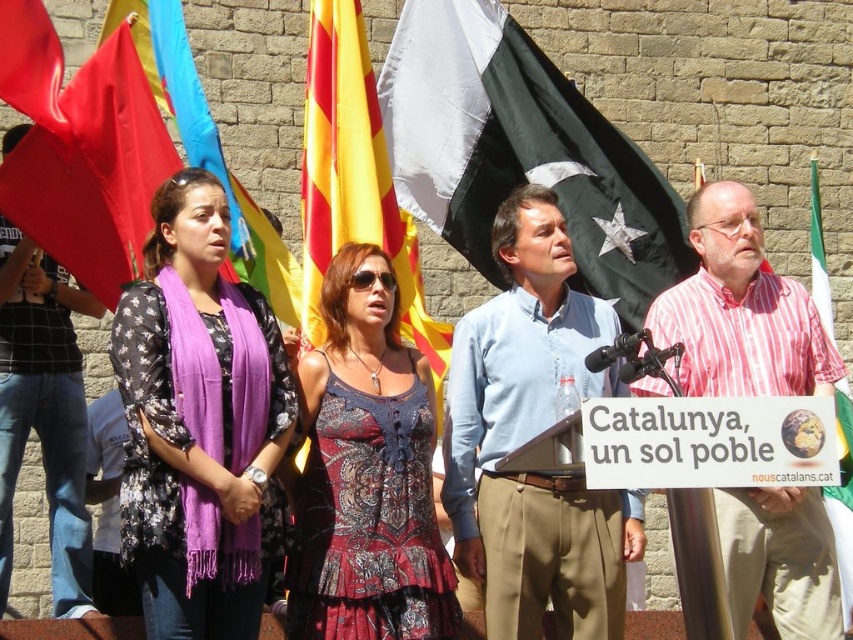
From the picture: Between light blue shirt at center and white paper sign at center, which one is positioned lower?

white paper sign at center

Which of these two, light blue shirt at center or white paper sign at center, stands taller?

Standing taller between the two is light blue shirt at center.

Locate an element on the screen. The image size is (853, 640). light blue shirt at center is located at coordinates (532, 436).

Does shiny red flag at upper left appear over red fabric flag at upper left?

Incorrect, shiny red flag at upper left is not positioned above red fabric flag at upper left.

Between shiny red flag at upper left and red fabric flag at upper left, which one is positioned higher?

Positioned higher is red fabric flag at upper left.

Is point (20, 44) closer to camera compared to point (129, 20)?

Yes, it is in front of point (129, 20).

This screenshot has height=640, width=853. What are the coordinates of `shiny red flag at upper left` in the screenshot? It's located at (32, 64).

Identify the location of purple scarf at center. (199, 422).

Where is `purple scarf at center`? Image resolution: width=853 pixels, height=640 pixels. purple scarf at center is located at coordinates (x=199, y=422).

I want to click on purple scarf at center, so click(x=199, y=422).